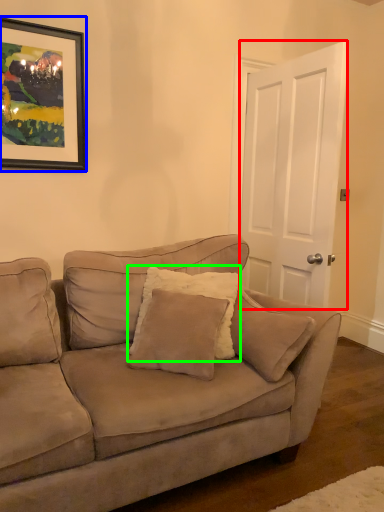
Question: Which object is the farthest from door (highlighted by a red box)? Choose among these: picture frame (highlighted by a blue box) or pillow (highlighted by a green box).

Choices:
 (A) picture frame
 (B) pillow

Answer: (A)